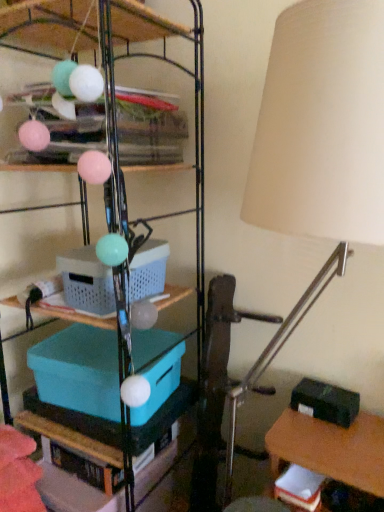
Question: Is teal plastic storage box at center-left, acting as the first storage box starting from the left, to the left or to the right of teal plastic storage bin at center, marked as the 1th shelf in a bottom-to-top arrangement, in the image?

Choices:
 (A) right
 (B) left

Answer: (A)

Question: Considering the positions of teal plastic storage box at center-left, which ranks as the third storage box in right-to-left order, and teal plastic storage bin at center, marked as the 1th shelf in a bottom-to-top arrangement, in the image, is teal plastic storage box at center-left, which ranks as the third storage box in right-to-left order, taller or shorter than teal plastic storage bin at center, marked as the 1th shelf in a bottom-to-top arrangement,?

Choices:
 (A) short
 (B) tall

Answer: (A)

Question: Which object is the farthest from the beige fabric lampshade at right?

Choices:
 (A) black matte storage box at lower right, which is counted as the third storage box, starting from the top
 (B) plastic basket at center, arranged as the 3th storage box when ordered from the bottom
 (C) teal plastic storage box at center-left, which ranks as the second storage box in bottom-to-top order
 (D) metallic wire shelving at upper center, marked as the 1th shelf in a top-to-bottom arrangement
 (E) teal plastic storage bin at center, marked as the 1th shelf in a bottom-to-top arrangement

Answer: (A)

Question: Considering the real-world distances, which object is closest to the beige fabric lampshade at right?

Choices:
 (A) teal plastic storage bin at center, which is counted as the 2th shelf, starting from the top
 (B) metallic wire shelving at upper center, marked as the 1th shelf in a top-to-bottom arrangement
 (C) teal plastic storage box at center-left, acting as the first storage box starting from the left
 (D) black matte storage box at lower right, marked as the 1th storage box in a right-to-left arrangement
 (E) plastic basket at center, placed as the 2th storage box when sorted from right to left

Answer: (E)